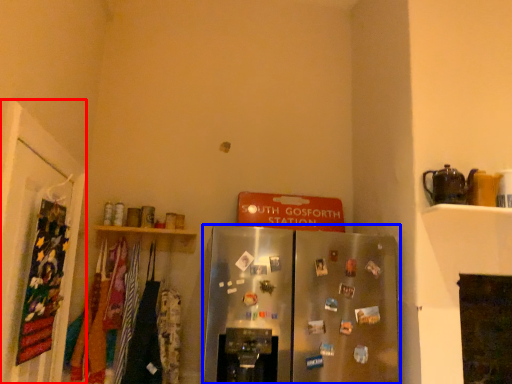
Question: Among these objects, which one is nearest to the camera, door (highlighted by a red box) or refrigerator (highlighted by a blue box)?

Choices:
 (A) door
 (B) refrigerator

Answer: (A)